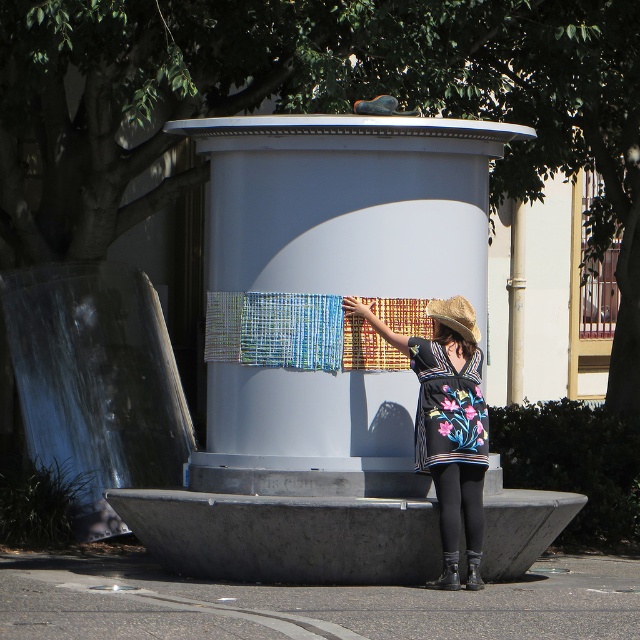
You are a photographer planning to take a photo of the floral dress at center and the textured woven cloth at center in the outdoor scene. Which object should you focus on first if you want to capture both in a single frame without moving the camera, considering their sizes?

The floral dress at center is larger in size than the textured woven cloth at center, so you should focus on the floral dress at center first to ensure it fills the frame appropriately before adjusting for the smaller cloth.

You are a photographer trying to capture the person in the scene. If you want to focus on the leather boot at lower center, should you position yourself to the left or right of the floral embroidered dress at center?

You should position yourself to the left of the floral embroidered dress at center because the leather boot at lower center is to the left of the floral embroidered dress at center.